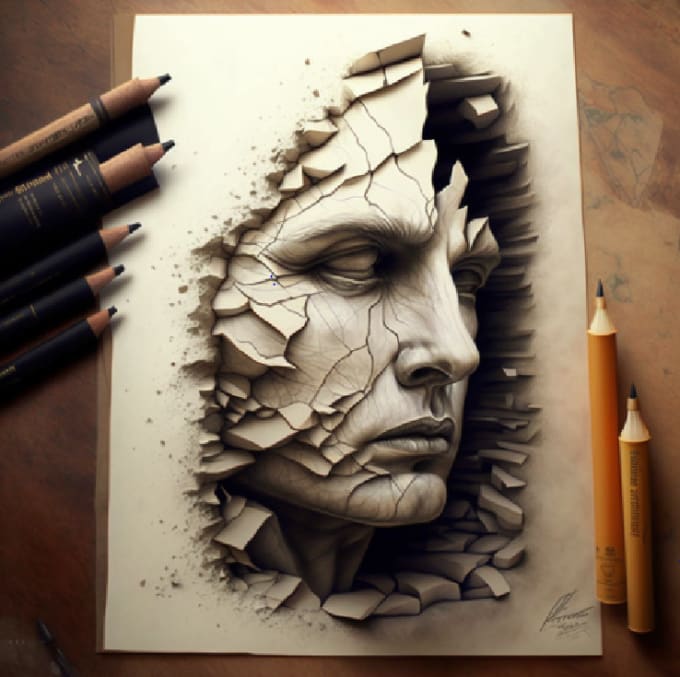
In order to click on light brown wood right side top half in this screenshot , I will do `click(649, 28)`, `click(661, 217)`, `click(662, 307)`.